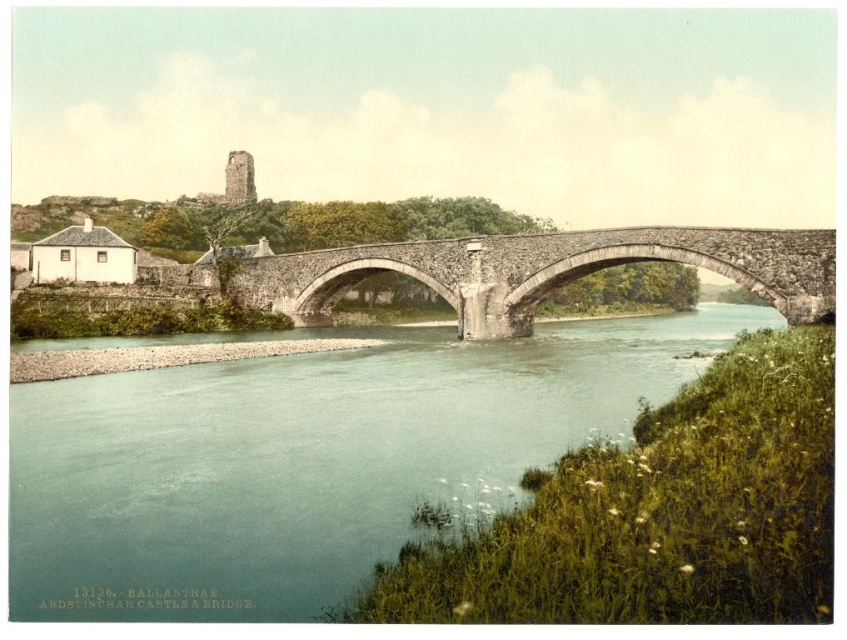
Question: Is clear blue water at center positioned before stone arch bridge at center?

Choices:
 (A) no
 (B) yes

Answer: (B)

Question: Where is clear blue water at center located in relation to stone arch bridge at center in the image?

Choices:
 (A) left
 (B) right

Answer: (A)

Question: Can you confirm if clear blue water at center is wider than stone arch bridge at center?

Choices:
 (A) no
 (B) yes

Answer: (B)

Question: Which object appears closest to the camera in this image?

Choices:
 (A) stone arch bridge at center
 (B) clear blue water at center

Answer: (B)